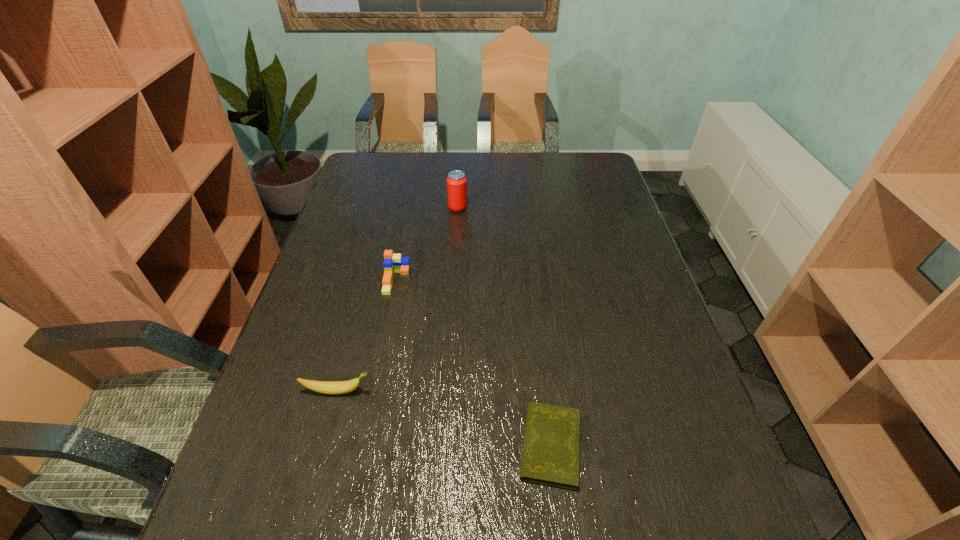
This screenshot has width=960, height=540. Find the location of `the third object from left to right`. the third object from left to right is located at coordinates (456, 182).

Locate an element on the screen. This screenshot has height=540, width=960. the farthest object is located at coordinates (456, 182).

This screenshot has height=540, width=960. I want to click on the second nearest object, so click(327, 387).

Find the location of `the second farthest object`. the second farthest object is located at coordinates (393, 263).

This screenshot has height=540, width=960. Identify the location of the rightmost object. (551, 448).

I want to click on the nearest object, so click(x=551, y=448).

What are the coordinates of `vacant space situated 0.060m on the back of the farthest object` in the screenshot? It's located at (459, 193).

The height and width of the screenshot is (540, 960). In order to click on free location located 0.080m at the stem of the banana in this screenshot , I will do `click(410, 391)`.

Identify the location of free space located 0.130m on the back of the second farthest object. Image resolution: width=960 pixels, height=540 pixels. (405, 238).

Locate an element on the screen. The image size is (960, 540). vacant space situated 0.080m on the right of the shortest object is located at coordinates (625, 446).